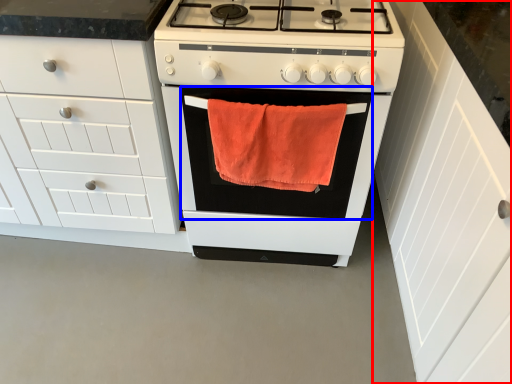
Question: Which object is closer to the camera taking this photo, cabinetry (highlighted by a red box) or oven (highlighted by a blue box)?

Choices:
 (A) cabinetry
 (B) oven

Answer: (A)